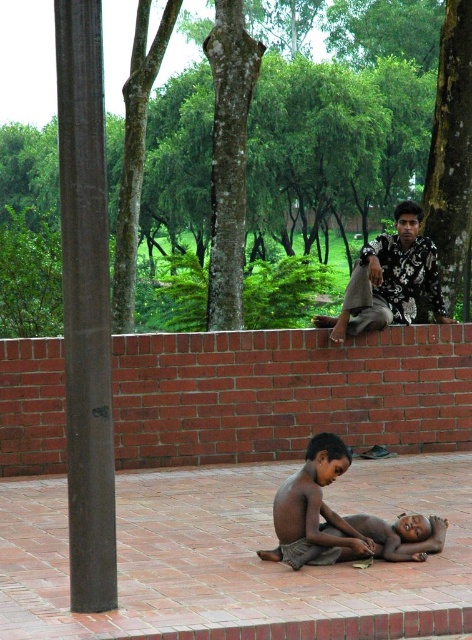
You are planning to place a small bench in the garden scene. The bench requires a space wider than the brown polished wood at left. Would the area near the green leafy tree at upper right provide enough width for the bench?

The brown polished wood at left is narrower than the green leafy tree at upper right, so the area near the green leafy tree at upper right has sufficient width to accommodate the bench.

You are standing in the park and want to take a photo of the brown polished wood at left and the green leafy tree at upper right. Which object should you focus on first to ensure both are in clear view?

You should focus on the brown polished wood at left first because it is closer to the viewer than the green leafy tree at upper right, so adjusting focus starting from the closer object ensures both are in clear view.